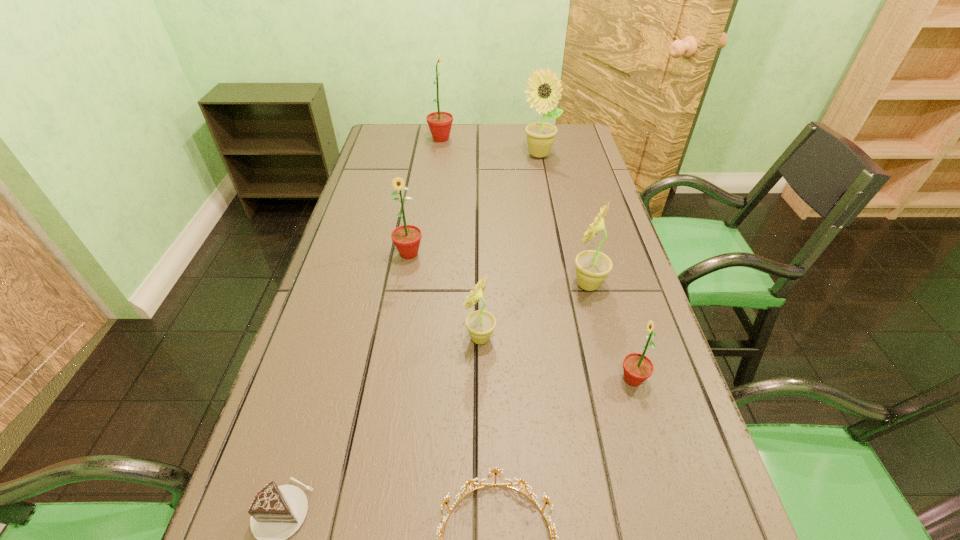
At what (x,y) coordinates should I click in order to perform the action: click on the biggest green sunflower. Please return your answer as a coordinate pair (x, y). This screenshot has width=960, height=540. Looking at the image, I should click on (440, 123).

The height and width of the screenshot is (540, 960). Identify the location of the farthest sunflower. (440, 123).

Where is `the second farthest object`? This screenshot has height=540, width=960. the second farthest object is located at coordinates (544, 89).

What are the coordinates of `the farthest yellow sunflower` in the screenshot? It's located at (544, 89).

Where is `the fifth nearest object`? This screenshot has height=540, width=960. the fifth nearest object is located at coordinates (592, 267).

At what (x,y) coordinates should I click in order to perform the action: click on the second farthest yellow sunflower. Please return your answer as a coordinate pair (x, y). The width and height of the screenshot is (960, 540). Looking at the image, I should click on (592, 267).

Identify the location of the third farthest sunflower. (406, 238).

Find the location of a particular element. The image size is (960, 540). the second smallest green sunflower is located at coordinates coord(406,238).

At what (x,y) coordinates should I click in order to perform the action: click on the fifth farthest object. Please return your answer as a coordinate pair (x, y). This screenshot has width=960, height=540. Looking at the image, I should click on (480, 324).

Image resolution: width=960 pixels, height=540 pixels. I want to click on the nearest yellow sunflower, so click(480, 324).